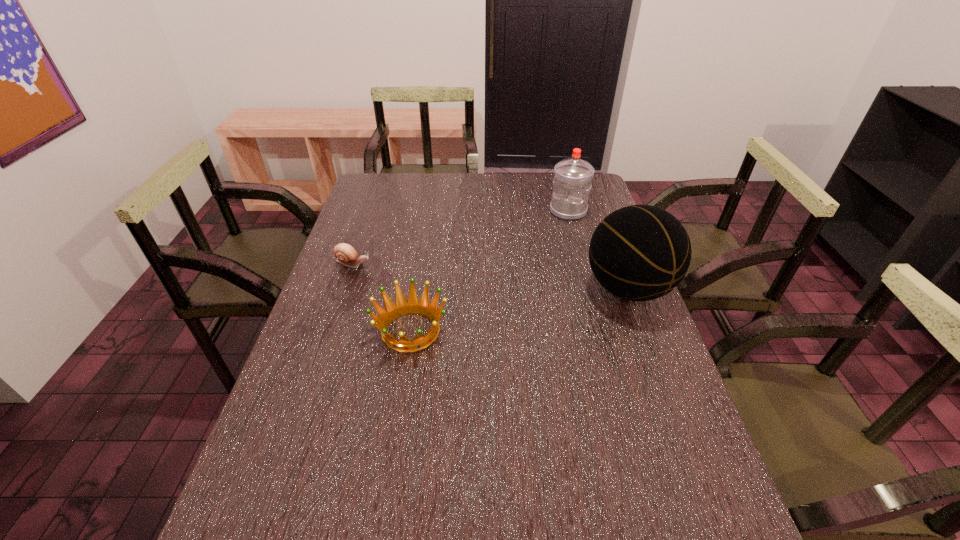
Image resolution: width=960 pixels, height=540 pixels. What are the coordinates of `vacant area that lies between the basketball and the crown` in the screenshot? It's located at (519, 309).

This screenshot has height=540, width=960. I want to click on vacant area that lies between the crown and the leftmost object, so click(382, 297).

At what (x,y) coordinates should I click in order to perform the action: click on free space between the basketball and the leftmost object. Please return your answer as a coordinate pair (x, y). The image size is (960, 540). Looking at the image, I should click on (491, 276).

Image resolution: width=960 pixels, height=540 pixels. Identify the location of object identified as the closest to the basketball. (572, 181).

Point out which object is positioned as the nearest to the shortest object. Please provide its 2D coordinates. Your answer should be formatted as a tuple, i.e. [(x, y)], where the tuple contains the x and y coordinates of a point satisfying the conditions above.

[(402, 306)]

Identify the location of free point that satisfies the following two spatial constraints: 1. on the front side of the basketball; 2. on the left side of the farthest object. (589, 288).

The width and height of the screenshot is (960, 540). I want to click on free space that satisfies the following two spatial constraints: 1. on the back side of the shortest object; 2. on the right side of the farthest object, so click(x=372, y=211).

Where is `free space that satisfies the following two spatial constraints: 1. on the front side of the water bottle; 2. on the right side of the basketball`? The height and width of the screenshot is (540, 960). free space that satisfies the following two spatial constraints: 1. on the front side of the water bottle; 2. on the right side of the basketball is located at coordinates (589, 288).

Find the location of `free space that satisfies the following two spatial constraints: 1. on the back side of the farthest object; 2. on the left side of the leftmost object`. free space that satisfies the following two spatial constraints: 1. on the back side of the farthest object; 2. on the left side of the leftmost object is located at coordinates (372, 211).